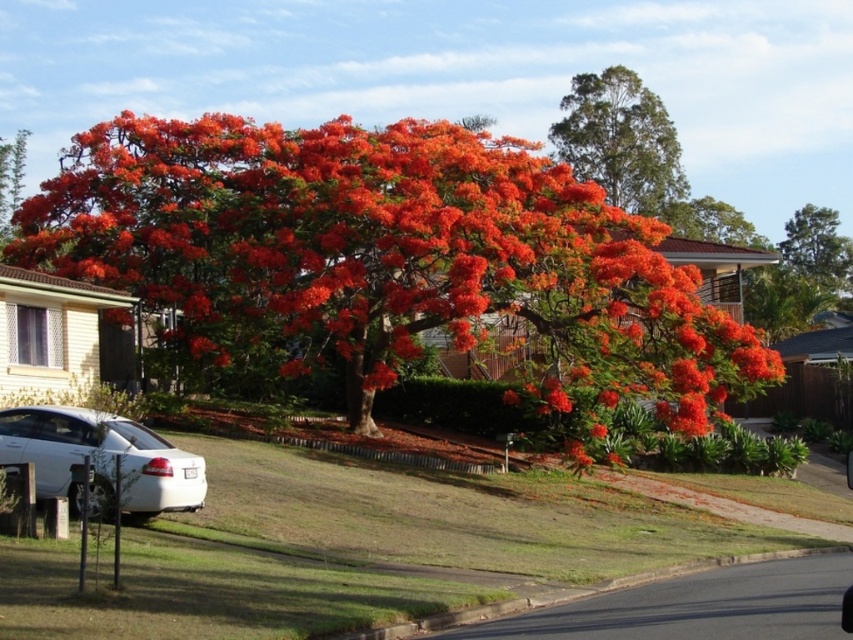
You are standing at the center of the image, which is the large tree with red orange blossoms. If you want to walk to the white glossy sedan at lower left, in which direction should you move?

You should move towards the lower left direction to reach the white glossy sedan at lower left.

In the scene shown: You are a gardener planning to plant a new tree in the area near the white glossy sedan at lower left and the vivid orange foliage at upper right. Considering their current positions, which object will be closer to the new tree if it is planted exactly halfway between them?

The white glossy sedan at lower left will be closer to the new tree because it is positioned in front of the vivid orange foliage at upper right, meaning it is nearer to the midpoint between them.